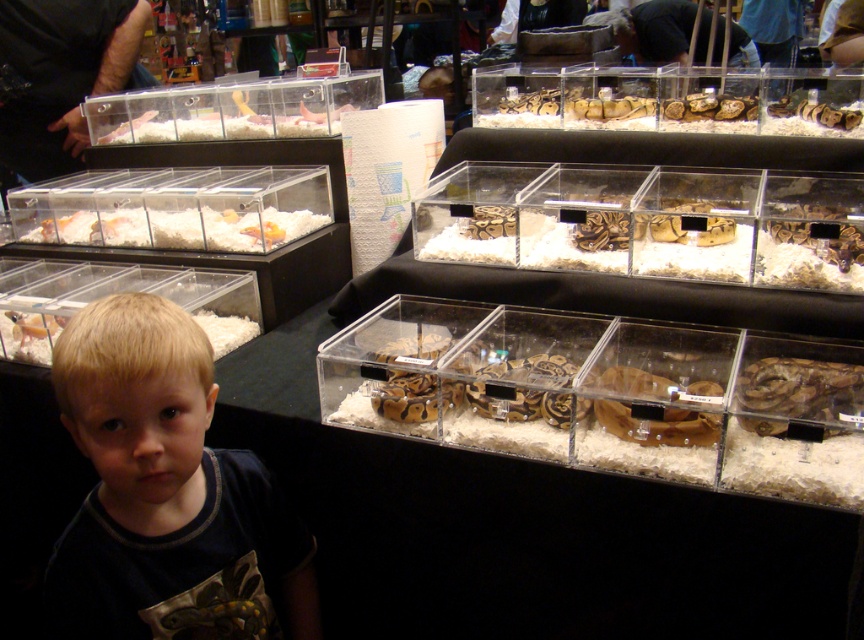
You are a parent at the reptile store event. You see your child, the blonde hair boy at lower left, and the white fluffy bedding at lower left. Which object is closer to the bottom edge of the image?

The blonde hair boy at lower left is closer to the bottom edge of the image because he is positioned below the white fluffy bedding at lower left.

You are a customer at the reptile store and want to know if the brown textured snake at upper center can fit inside the translucent plastic container at center. Based on their sizes, what do you think?

The brown textured snake at upper center is larger in size than the translucent plastic container at center, so it cannot fit inside.

You are a customer at a reptile store and want to know if the brown textured snake at upper center can fit inside the translucent plastic container at center. Based on their sizes, can it fit?

The brown textured snake at upper center is much taller than the translucent plastic container at center, so it cannot fit inside.